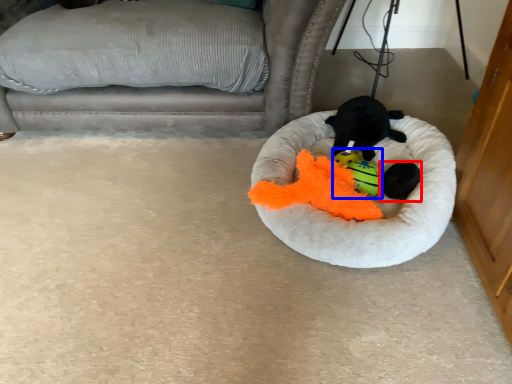
Question: Which object appears closest to the camera in this image, animal (highlighted by a red box) or toy (highlighted by a blue box)?

Choices:
 (A) animal
 (B) toy

Answer: (A)